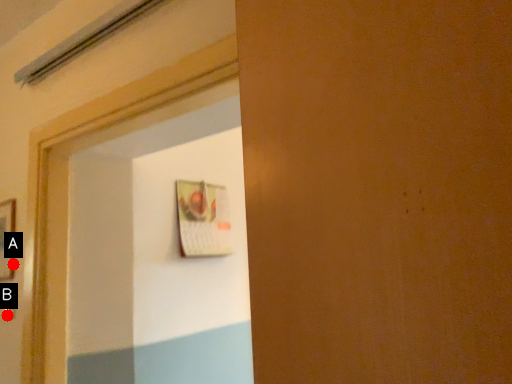
Question: Two points are circled on the image, labeled by A and B beside each circle. Which point is closer to the camera?

Choices:
 (A) A is closer
 (B) B is closer

Answer: (B)